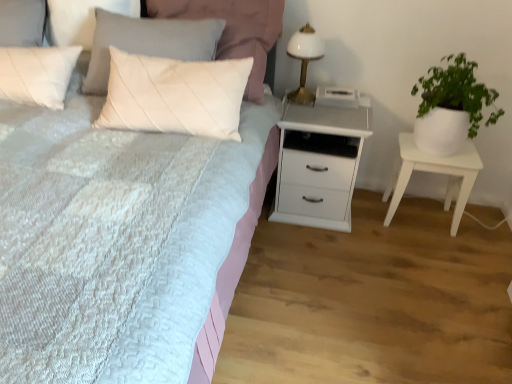
What are the coordinates of `vacant location below white matte nightstand at right (from a real-world perspective)` in the screenshot? It's located at (419, 217).